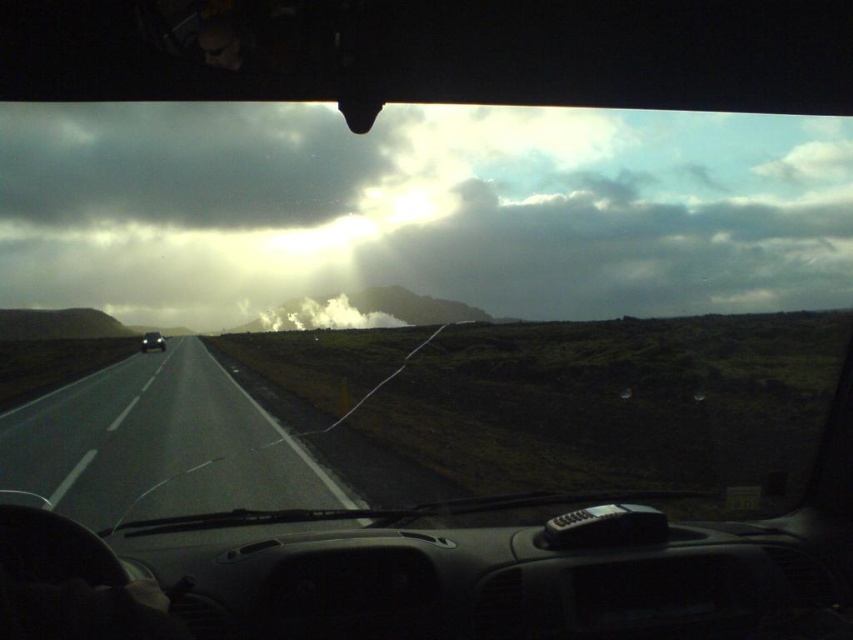
You are driving and looking through the windshield. There is a point marked at coordinates (421, 209). What does this point correspond to in the scene?

The point at (421, 209) corresponds to the cloudy sky at upper center.

You are driving and looking through the windshield. Where is the cloudy sky at upper center located in the image?

The cloudy sky at upper center is located at point coordinates of approximately [421,209].

You are driving and need to navigate around an obstacle ahead. There are two points marked on your GPS display at coordinates point (279, 432) and point (157, 337). Which point should you prioritize checking first for potential hazards?

Point (279, 432) should be prioritized because it is in front of point (157, 337), meaning it is closer to your current position and therefore requires immediate attention.